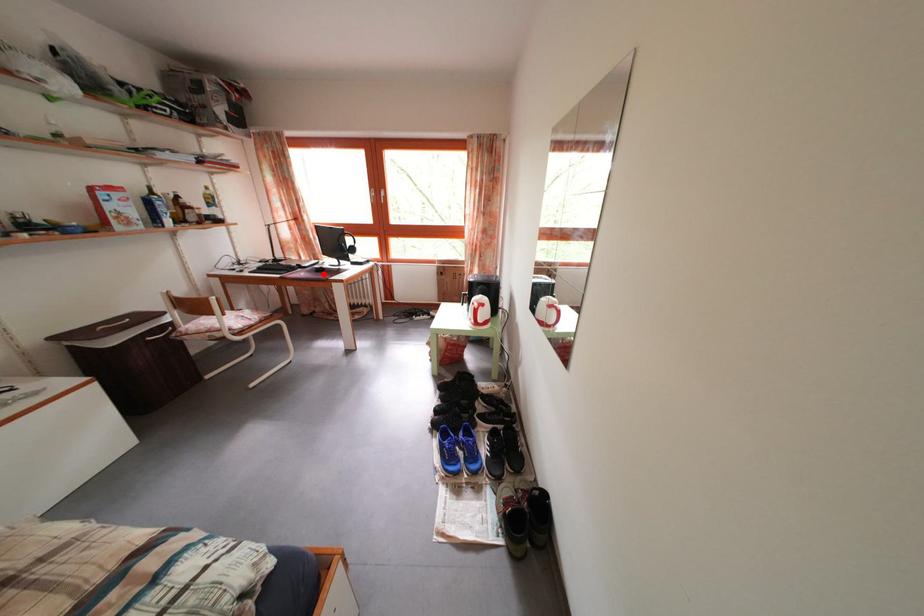
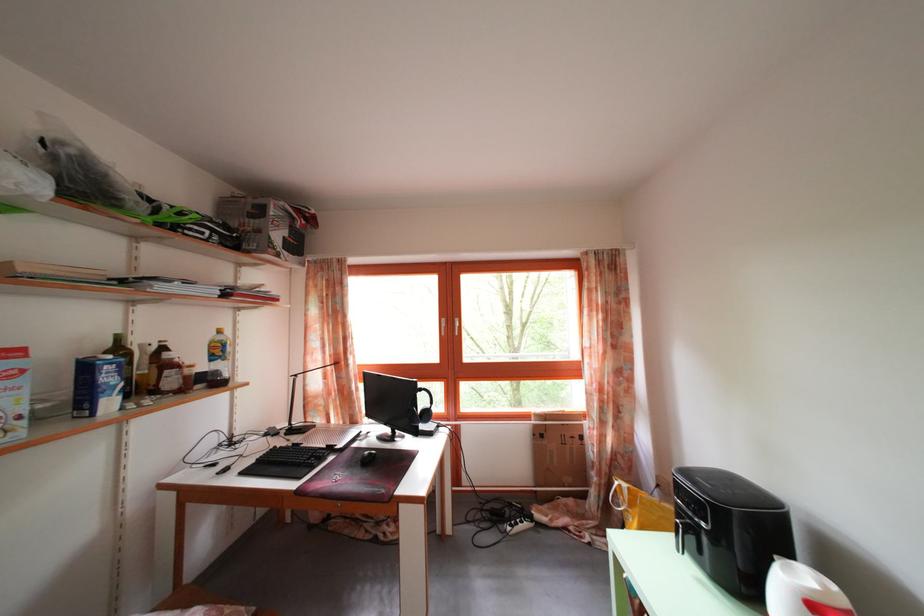
Find the pixel in the second image that matches the highlighted location in the first image.

(363, 451)